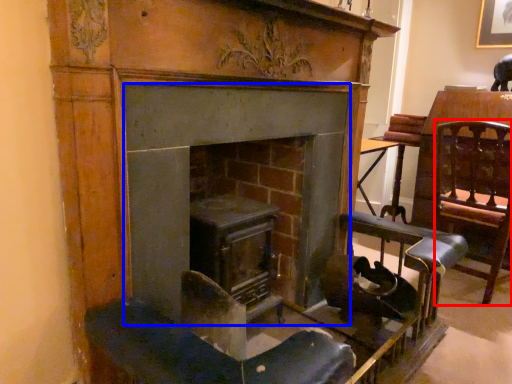
Question: Which object appears closest to the camera in this image, swivel chair (highlighted by a red box) or fireplace (highlighted by a blue box)?

Choices:
 (A) swivel chair
 (B) fireplace

Answer: (B)